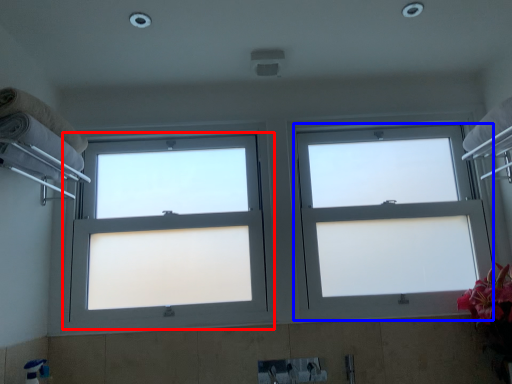
Question: Which object is closer to the camera taking this photo, window (highlighted by a red box) or window (highlighted by a blue box)?

Choices:
 (A) window
 (B) window

Answer: (A)